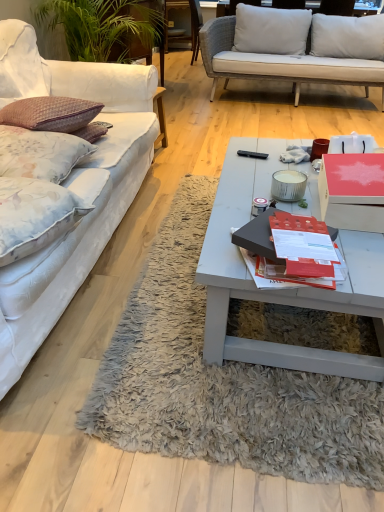
Find the location of a particular element. The width and height of the screenshot is (384, 512). red cardboard box at center is located at coordinates (352, 191).

Image resolution: width=384 pixels, height=512 pixels. I want to click on wooden chair at upper center, so click(182, 28).

What do you see at coordinates (83, 197) in the screenshot?
I see `white fabric couch at left` at bounding box center [83, 197].

Describe the element at coordinates (34, 215) in the screenshot. I see `floral fabric pillow at left, arranged as the 1th pillow when viewed from the front` at that location.

Identify the location of floral fabric pillow at left, marked as the second pillow in a back-to-front arrangement. Image resolution: width=384 pixels, height=512 pixels. (34, 215).

Locate an element on the screen. This screenshot has width=384, height=512. floral fabric pillow at left, the first pillow from the back is located at coordinates (40, 153).

Is matte black book at center closer to camera compared to floral fabric pillow at left, which appears as the 2th pillow when viewed from the front?

Yes, matte black book at center is closer to the camera.

Could you tell me if matte black book at center is facing floral fabric pillow at left, the first pillow from the back?

No.

At what (x,y) coordinates should I click in order to perform the action: click on the 2nd pillow positioned above the matte black book at center (from the image's perspective). Please return your answer as a coordinate pair (x, y). Looking at the image, I should click on (40, 153).

Measure the distance from matte black book at center to floral fabric pillow at left, which appears as the 2th pillow when viewed from the front.

A distance of 31.16 inches exists between matte black book at center and floral fabric pillow at left, which appears as the 2th pillow when viewed from the front.

Would you say matte black book at center is a long distance from wooden chair at upper center?

Indeed, matte black book at center is not near wooden chair at upper center.

Is matte black book at center oriented away from wooden chair at upper center?

matte black book at center is not turned away from wooden chair at upper center.

Where is `chair behind the matte black book at center`? The height and width of the screenshot is (512, 384). chair behind the matte black book at center is located at coordinates (182, 28).

Is point (233, 144) behind point (117, 73)?

That is False.

Can you confirm if matte gray coffee table at center is positioned to the left of white fabric couch at left?

Incorrect, matte gray coffee table at center is not on the left side of white fabric couch at left.

Is matte gray coffee table at center placed right next to white fabric couch at left?

No, matte gray coffee table at center is not in contact with white fabric couch at left.

Is white fabric couch at left not close to wooden chair at upper center?

Yes, white fabric couch at left and wooden chair at upper center are quite far apart.

From a real-world perspective, which object stands above the other?

In real-world perspective, white fabric couch at left is above.

What's the angular difference between white fabric couch at left and wooden chair at upper center's facing directions?

The facing directions of white fabric couch at left and wooden chair at upper center are 90 degrees apart.

Considering the sizes of objects white fabric couch at left and wooden chair at upper center in the image provided, who is shorter, white fabric couch at left or wooden chair at upper center?

Standing shorter between the two is wooden chair at upper center.

Does floral fabric pillow at left, which appears as the 2th pillow when viewed from the front, contain matte gray coffee table at center?

Definitely not — matte gray coffee table at center is not inside floral fabric pillow at left, which appears as the 2th pillow when viewed from the front.

Where is `coffee table below the floral fabric pillow at left, the first pillow from the back (from the image's perspective)`? coffee table below the floral fabric pillow at left, the first pillow from the back (from the image's perspective) is located at coordinates (281, 289).

Would you consider floral fabric pillow at left, which appears as the 2th pillow when viewed from the front, to be distant from matte gray coffee table at center?

They are positioned close to each other.

Consider the image. Can floral fabric pillow at left, arranged as the 1th pillow when viewed from the front, be found inside red cardboard box at center?

No, floral fabric pillow at left, arranged as the 1th pillow when viewed from the front, is located outside of red cardboard box at center.

In the image, is red cardboard box at center positioned in front of or behind floral fabric pillow at left, marked as the second pillow in a back-to-front arrangement?

Clearly, red cardboard box at center is behind floral fabric pillow at left, marked as the second pillow in a back-to-front arrangement.

Is point (351, 155) closer or farther from the camera than point (33, 234)?

Point (351, 155) is positioned farther from the camera compared to point (33, 234).

Does floral fabric pillow at left, marked as the second pillow in a back-to-front arrangement, touch floral fabric pillow at left, the first pillow from the back?

No.

Is floral fabric pillow at left, marked as the second pillow in a back-to-front arrangement, positioned behind floral fabric pillow at left, which appears as the 2th pillow when viewed from the front?

No, it is not.

Considering the sizes of objects floral fabric pillow at left, marked as the second pillow in a back-to-front arrangement, and floral fabric pillow at left, which appears as the 2th pillow when viewed from the front, in the image provided, who is thinner, floral fabric pillow at left, marked as the second pillow in a back-to-front arrangement, or floral fabric pillow at left, which appears as the 2th pillow when viewed from the front,?

floral fabric pillow at left, marked as the second pillow in a back-to-front arrangement, is thinner.

Between floral fabric pillow at left, arranged as the 1th pillow when viewed from the front, and floral fabric pillow at left, which appears as the 2th pillow when viewed from the front, which one appears on the left side from the viewer's perspective?

From the viewer's perspective, floral fabric pillow at left, which appears as the 2th pillow when viewed from the front, appears more on the left side.

Identify the location of book on the right of floral fabric pillow at left, which appears as the 2th pillow when viewed from the front. The width and height of the screenshot is (384, 512). (256, 237).

Identify the location of chair located behind the matte black book at center. (182, 28).

From the image, which object appears to be farther from matte black book at center, matte gray coffee table at center or floral fabric pillow at left, arranged as the 1th pillow when viewed from the front?

floral fabric pillow at left, arranged as the 1th pillow when viewed from the front, is positioned further to the anchor matte black book at center.

From the picture: Estimate the real-world distances between objects in this image. Which object is closer to wooden chair at upper center, red cardboard box at center or matte gray coffee table at center?

matte gray coffee table at center is positioned closer to the anchor wooden chair at upper center.

When comparing their distances from matte gray coffee table at center, does white fabric couch at left or floral fabric pillow at left, marked as the second pillow in a back-to-front arrangement, seem closer?

Based on the image, floral fabric pillow at left, marked as the second pillow in a back-to-front arrangement, appears to be nearer to matte gray coffee table at center.

Which object lies nearer to the anchor point white fabric couch at left, matte gray coffee table at center or matte black book at center?

Among the two, matte gray coffee table at center is located nearer to white fabric couch at left.

Which object lies nearer to the anchor point floral fabric pillow at left, arranged as the 1th pillow when viewed from the front, white fabric couch at left or matte gray coffee table at center?

The object closer to floral fabric pillow at left, arranged as the 1th pillow when viewed from the front, is white fabric couch at left.

From the image, which object appears to be nearer to red cardboard box at center, white fabric couch at left or floral fabric pillow at left, which appears as the 2th pillow when viewed from the front?

The object closer to red cardboard box at center is white fabric couch at left.

Looking at the image, which one is located further to floral fabric pillow at left, marked as the second pillow in a back-to-front arrangement, red cardboard box at center or matte black book at center?

red cardboard box at center lies further to floral fabric pillow at left, marked as the second pillow in a back-to-front arrangement, than the other object.

Based on the photo, from the image, which object appears to be farther from white fabric couch at left, floral fabric pillow at left, arranged as the 1th pillow when viewed from the front, or floral fabric pillow at left, the first pillow from the back?

floral fabric pillow at left, arranged as the 1th pillow when viewed from the front.

The width and height of the screenshot is (384, 512). Find the location of `coffee table situated between matte black book at center and red cardboard box at center from left to right`. coffee table situated between matte black book at center and red cardboard box at center from left to right is located at coordinates (281, 289).

At what (x,y) coordinates should I click in order to perform the action: click on box between matte black book at center and wooden chair at upper center in the front-back direction. Please return your answer as a coordinate pair (x, y). Image resolution: width=384 pixels, height=512 pixels. Looking at the image, I should click on (352, 191).

Where is `box between floral fabric pillow at left, arranged as the 1th pillow when viewed from the front, and wooden chair at upper center, along the z-axis`? The width and height of the screenshot is (384, 512). box between floral fabric pillow at left, arranged as the 1th pillow when viewed from the front, and wooden chair at upper center, along the z-axis is located at coordinates (352, 191).

Image resolution: width=384 pixels, height=512 pixels. What are the coordinates of `book between floral fabric pillow at left, marked as the second pillow in a back-to-front arrangement, and matte gray coffee table at center, in the horizontal direction` in the screenshot? It's located at (256, 237).